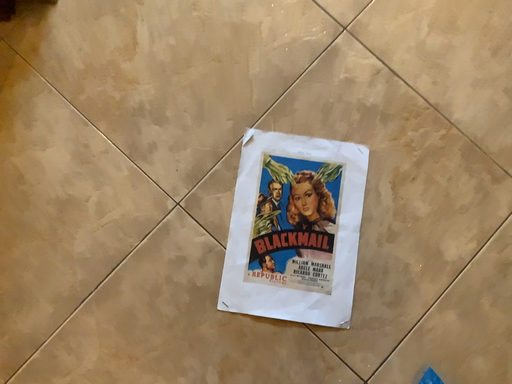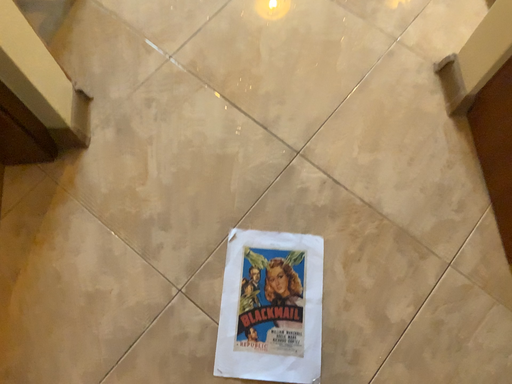
Question: How did the camera likely rotate when shooting the video?

Choices:
 (A) rotated upward
 (B) rotated downward

Answer: (A)